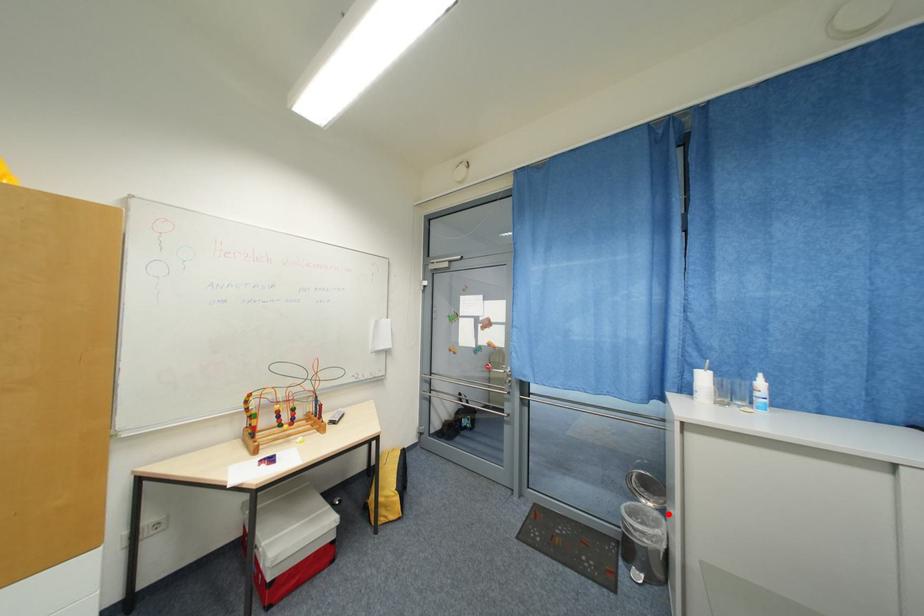
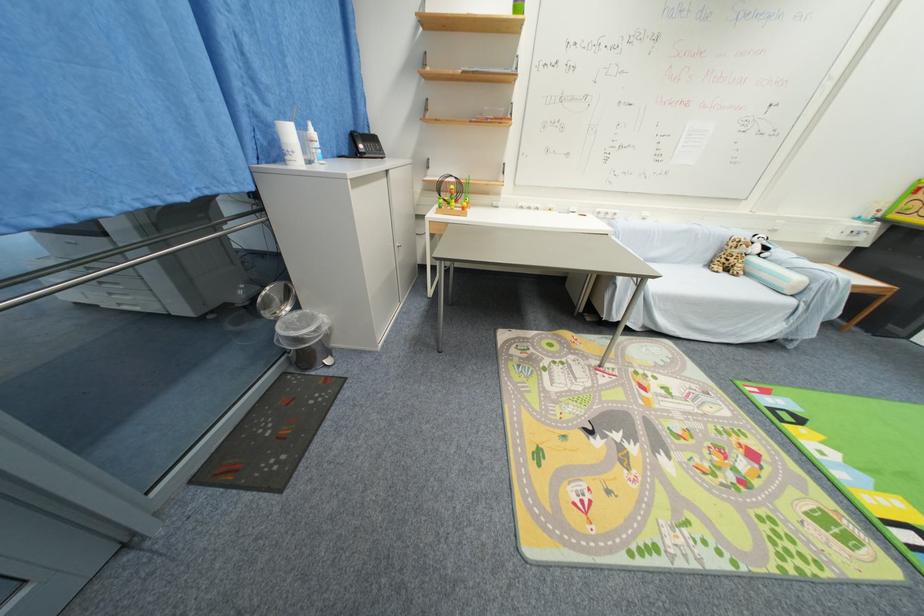
In the second image, find the point that corresponds to the highlighted location in the first image.

(301, 309)